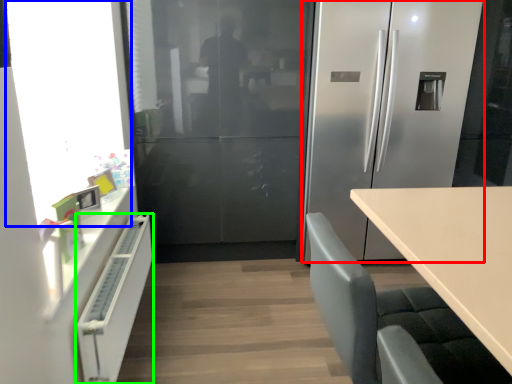
Question: Considering the real-world distances, which object is farthest from refrigerator (highlighted by a red box)? window screen (highlighted by a blue box) or cabinetry (highlighted by a green box)?

Choices:
 (A) window screen
 (B) cabinetry

Answer: (B)